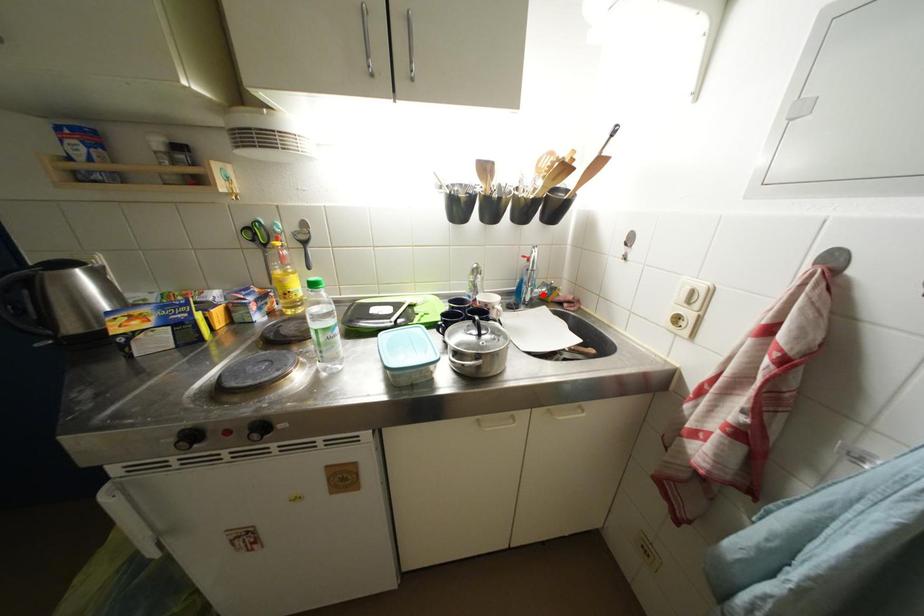
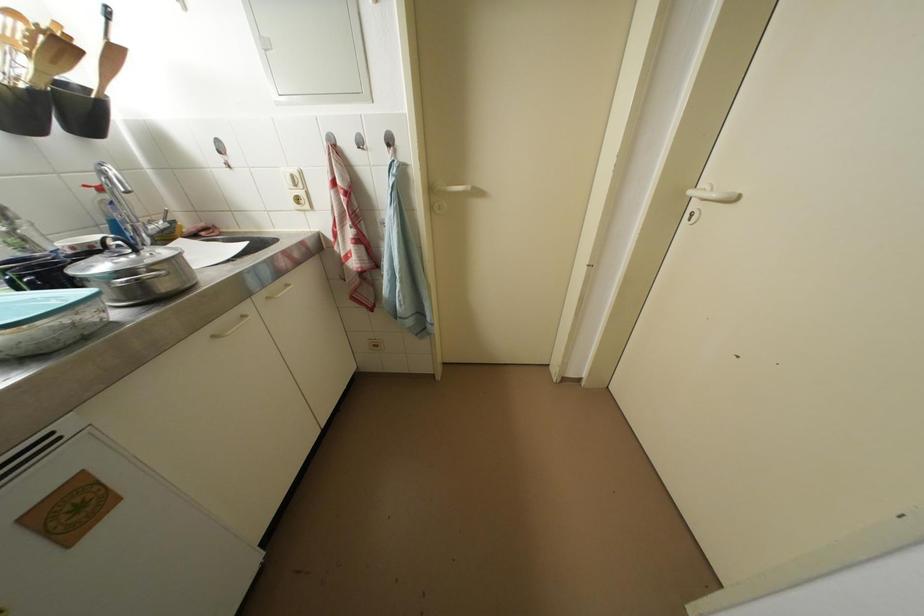
In the second image, find the point that corresponds to the highlighted location in the first image.

(157, 231)